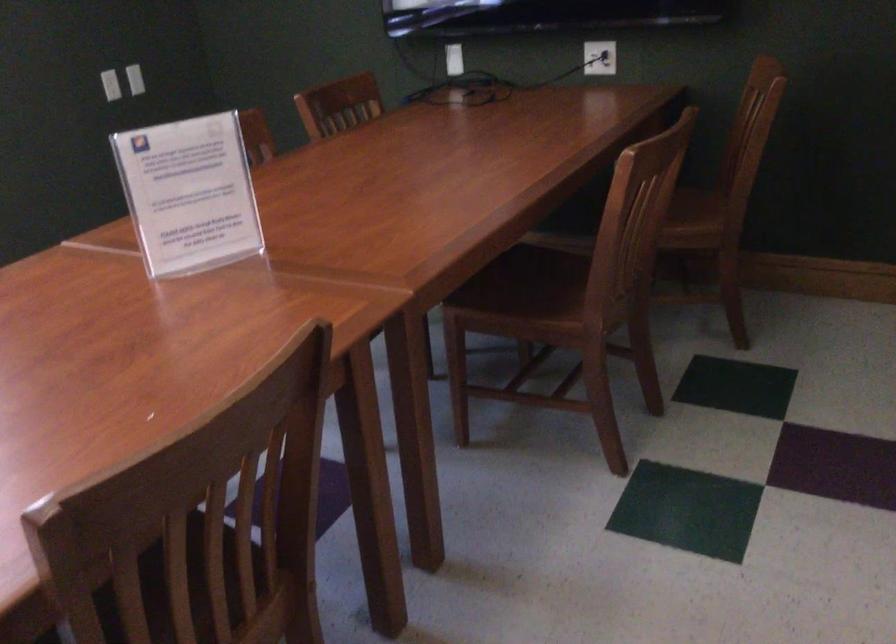
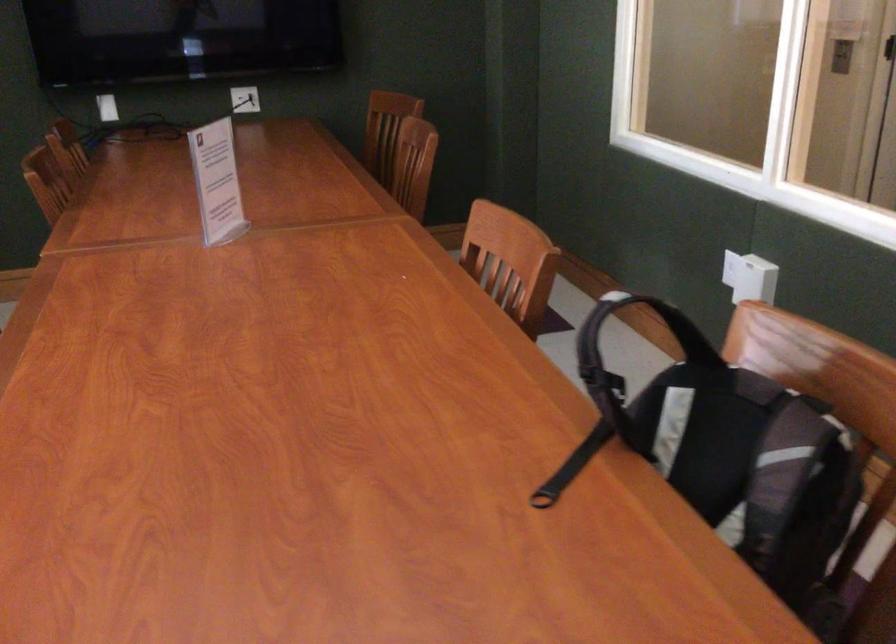
Where in the second image is the point corresponding to (x=213, y=462) from the first image?

(510, 261)